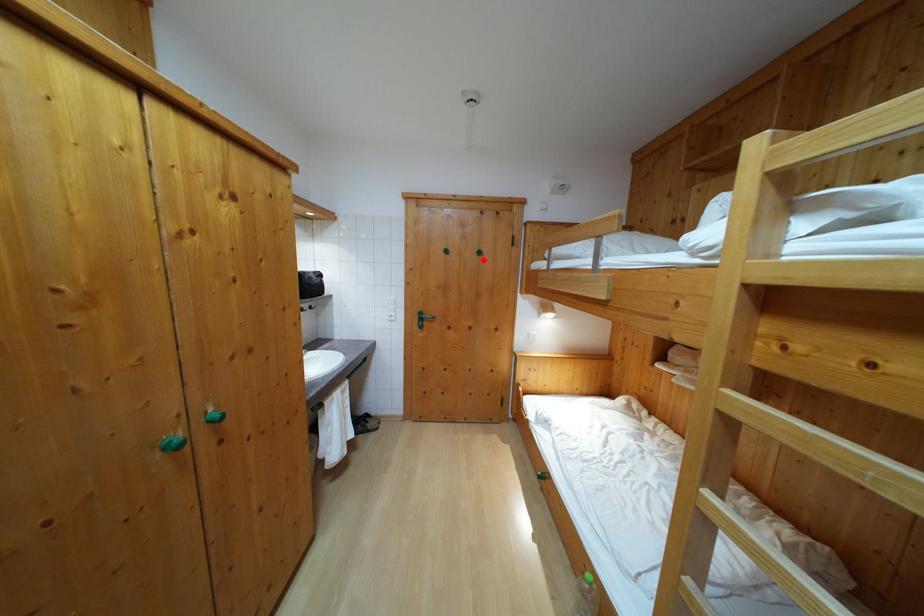
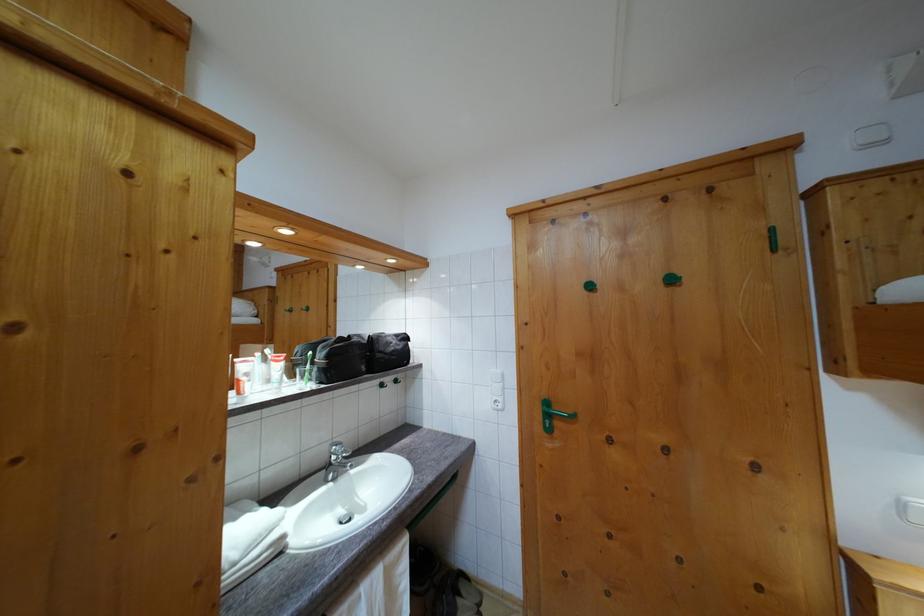
The point at the highlighted location is marked in the first image. Where is the corresponding point in the second image?

(675, 286)